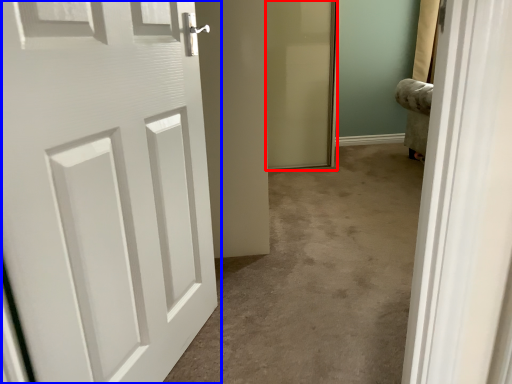
Question: Which of the following is the farthest to the observer, screen door (highlighted by a red box) or door (highlighted by a blue box)?

Choices:
 (A) screen door
 (B) door

Answer: (A)